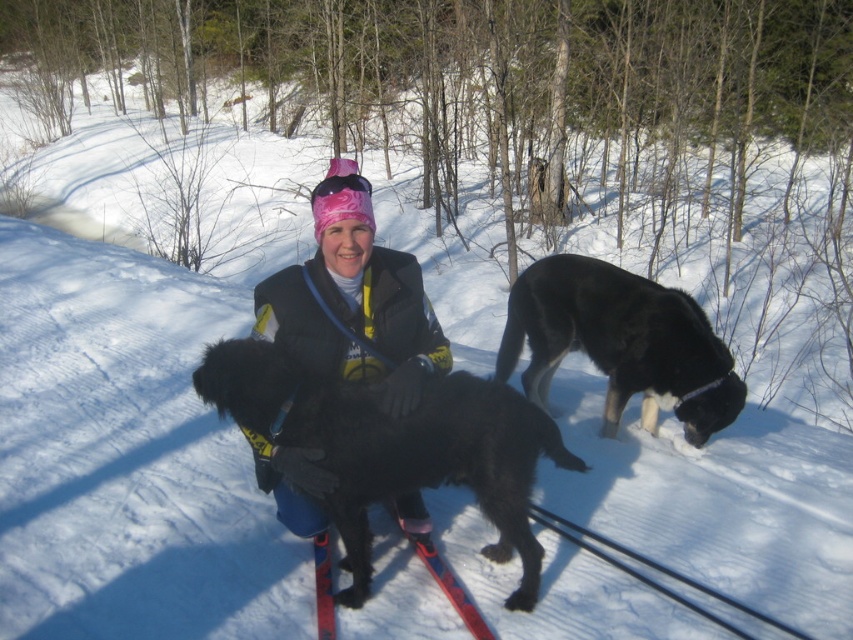
You are standing in the snowy forest scene. You see the matte black jacket at center and the black fur dog at right. Which object is higher up in the image?

The matte black jacket at center is located above the black fur dog at right, so the matte black jacket at center is higher up in the image.

You are the person in the image wearing the matte black jacket at center. You want to throw a snowball to the black fur dog at right. Which direction should you move to ensure the dog can see you clearly?

The matte black jacket at center is in front of the black fur dog at right, so you should move to the side to ensure the dog can see you clearly.

You are a hiker lost in the snowy forest. You see a black fuzzy dog at center and a black fur dog at right. Which dog is closer to you?

The black fuzzy dog at center is closer to you because it is positioned below the black fur dog at right, indicating it is nearer in the visual plane.